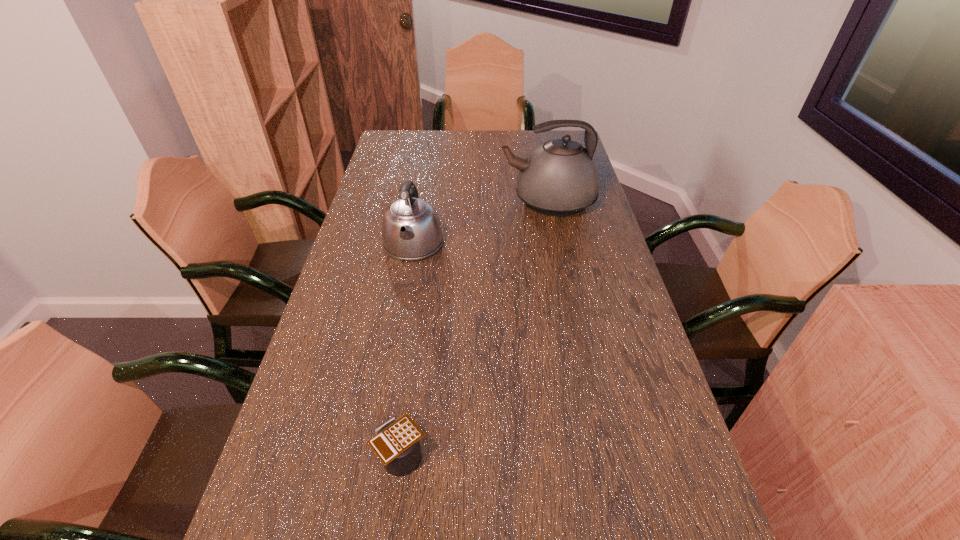
This screenshot has width=960, height=540. In order to click on the taller kettle in this screenshot , I will do `click(559, 178)`.

Identify the location of the rightmost object. The image size is (960, 540). (559, 178).

Where is `the left kettle`? This screenshot has width=960, height=540. the left kettle is located at coordinates (411, 230).

At what (x,y) coordinates should I click in order to perform the action: click on the second shortest object. Please return your answer as a coordinate pair (x, y). Looking at the image, I should click on (411, 230).

Image resolution: width=960 pixels, height=540 pixels. What are the coordinates of `the nearest object` in the screenshot? It's located at (396, 443).

In order to click on the shortest object in this screenshot , I will do `click(396, 443)`.

Where is `free space located 0.170m at the spout of the right kettle`? This screenshot has height=540, width=960. free space located 0.170m at the spout of the right kettle is located at coordinates (452, 201).

I want to click on blank space located 0.360m at the spout of the right kettle, so click(398, 201).

Image resolution: width=960 pixels, height=540 pixels. Find the location of `free region located 0.270m at the spout of the right kettle`. free region located 0.270m at the spout of the right kettle is located at coordinates (423, 201).

What are the coordinates of `vacant space positioned on the spout of the left kettle` in the screenshot? It's located at (398, 325).